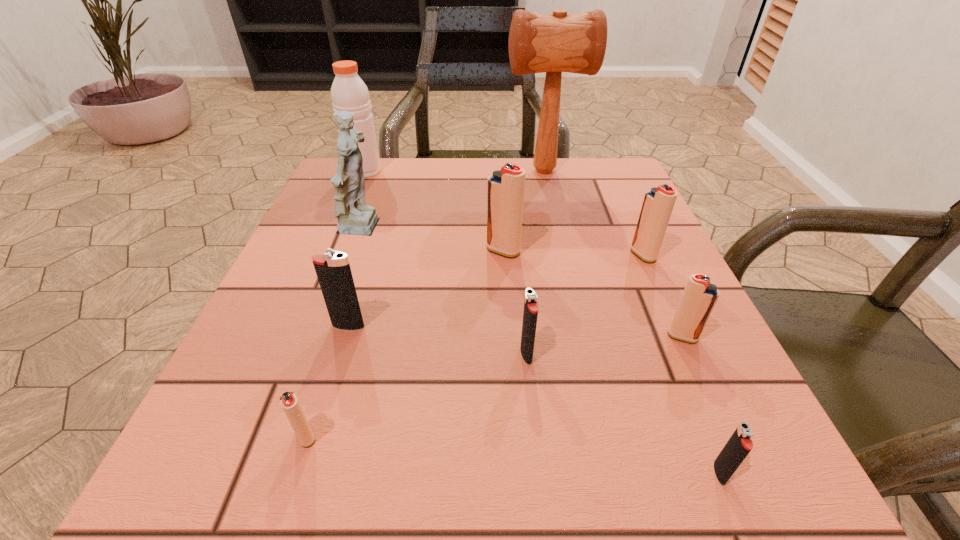
Locate an element on the screen. The image size is (960, 540). the tallest object is located at coordinates (554, 43).

You are a GUI agent. You are given a task and a screenshot of the screen. Output one action in this format:
    pyautogui.click(x=<x>, y=<y>)
    Task: Click on the shaker
    This screenshot has width=960, height=540.
    Given the screenshot: What is the action you would take?
    pyautogui.click(x=349, y=93)

I want to click on figurine, so click(354, 217).

This screenshot has height=540, width=960. Identify the location of the tallest igniter. (505, 188).

The image size is (960, 540). What are the coordinates of `the biggest red igniter` in the screenshot? It's located at (505, 188).

Locate an element on the screen. Image resolution: width=960 pixels, height=540 pixels. the second biggest red igniter is located at coordinates (658, 203).

Locate an element on the screen. the leftmost black igniter is located at coordinates (334, 274).

The width and height of the screenshot is (960, 540). I want to click on the biggest black igniter, so click(x=334, y=274).

This screenshot has height=540, width=960. What are the coordinates of `the second farthest black igniter` in the screenshot? It's located at (530, 314).

The height and width of the screenshot is (540, 960). Identify the location of the second smallest black igniter. (530, 314).